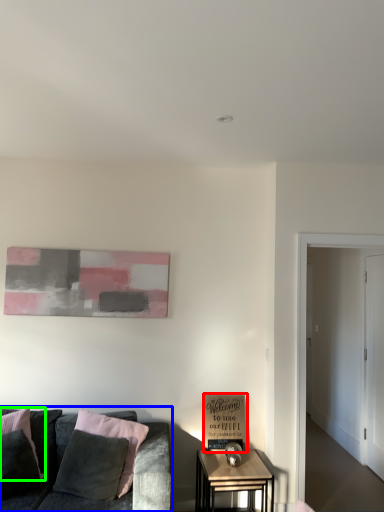
Question: Which is nearer to the cardboard box (highlighted by a red box)? studio couch (highlighted by a blue box) or pillow (highlighted by a green box).

Choices:
 (A) studio couch
 (B) pillow

Answer: (A)